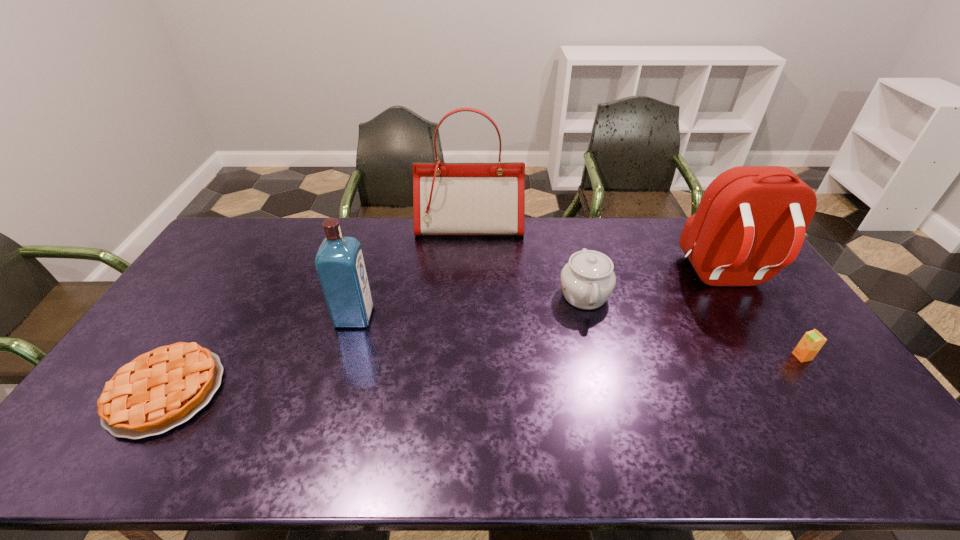
Find the location of a particular element. Image resolution: width=960 pixels, height=540 pixels. free spot that satisfies the following two spatial constraints: 1. on the flat label side of the second object from left to right; 2. on the right side of the orange juice is located at coordinates (343, 356).

This screenshot has width=960, height=540. I want to click on free location that satisfies the following two spatial constraints: 1. on the strap side of the backpack; 2. on the right side of the second shortest object, so click(x=774, y=356).

Where is `free region that satisfies the following two spatial constraints: 1. on the strap side of the backpack; 2. on the flat label side of the liquor`? The width and height of the screenshot is (960, 540). free region that satisfies the following two spatial constraints: 1. on the strap side of the backpack; 2. on the flat label side of the liquor is located at coordinates coord(748,316).

Identify the location of free space that satisfies the following two spatial constraints: 1. on the flat label side of the fourth shortest object; 2. on the front side of the shortest object. (332, 392).